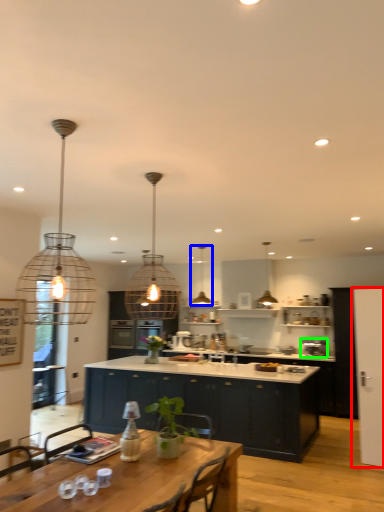
Question: Considering the real-world distances, which object is closest to glass door (highlighted by a red box)? lamp (highlighted by a blue box) or appliance (highlighted by a green box).

Choices:
 (A) lamp
 (B) appliance

Answer: (B)